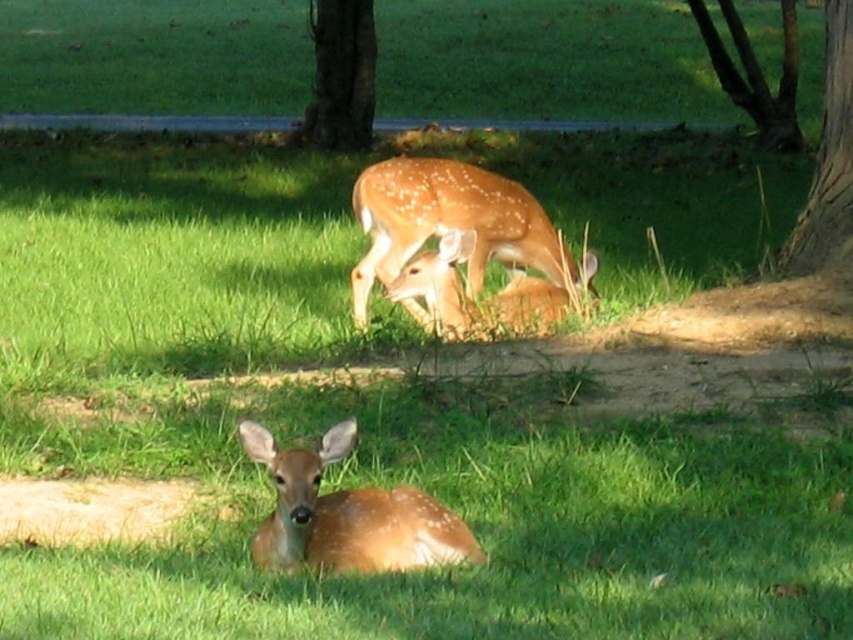
Between point (776, 268) and point (787, 132), which one is positioned behind?

Point (787, 132)

Does smooth bark tree trunk at right have a greater height compared to brown rough bark tree at upper center?

Indeed, smooth bark tree trunk at right has a greater height compared to brown rough bark tree at upper center.

Does point (833, 54) come closer to viewer compared to point (788, 132)?

Yes.

This screenshot has width=853, height=640. In order to click on smooth bark tree trunk at right in this screenshot , I will do `click(827, 156)`.

Is point (401, 173) closer to viewer compared to point (717, 56)?

Yes.

Looking at this image, between spotted fur deer at center and brown rough bark tree at upper center, which one has more height?

Standing taller between the two is spotted fur deer at center.

Does point (390, 182) come closer to viewer compared to point (757, 118)?

Yes, it is.

I want to click on spotted fur deer at center, so click(x=451, y=224).

Describe the element at coordinates (340, 76) in the screenshot. I see `brown rough tree at upper center` at that location.

Is brown rough tree at upper center below brown rough bark tree at upper center?

Indeed, brown rough tree at upper center is positioned under brown rough bark tree at upper center.

Locate an element on the screen. brown rough tree at upper center is located at coordinates (340, 76).